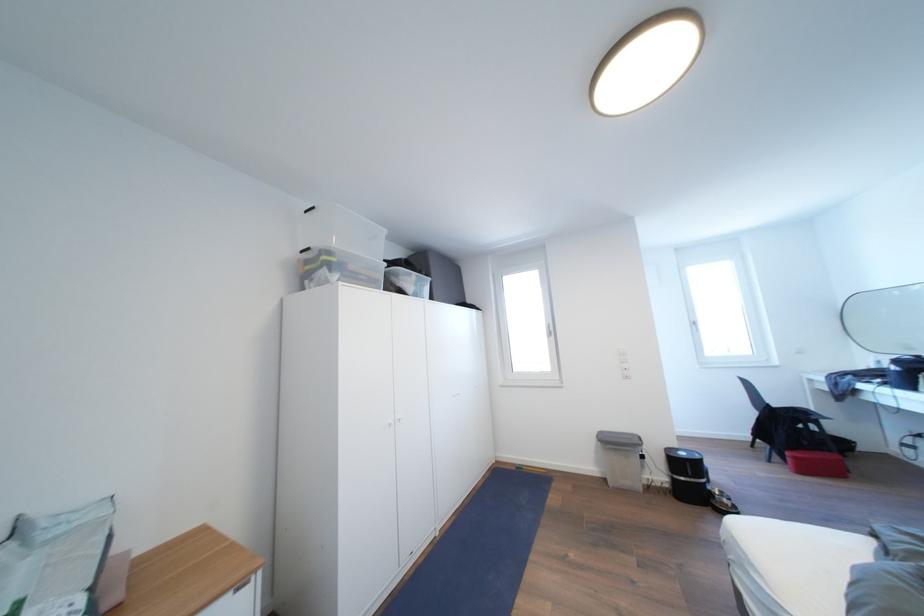
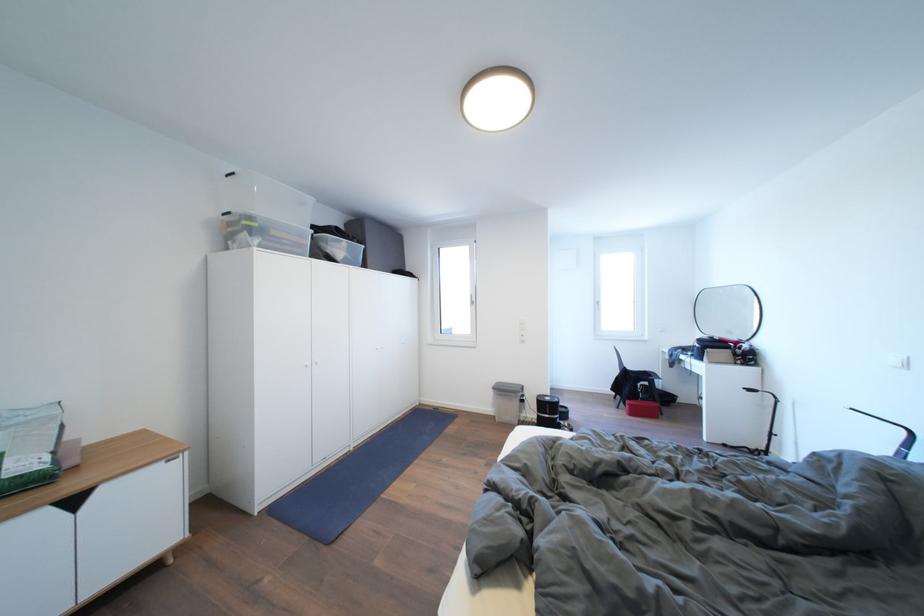
In a continuous first-person perspective shot, in which direction is the camera moving?

The cameraman walked toward right, backward.